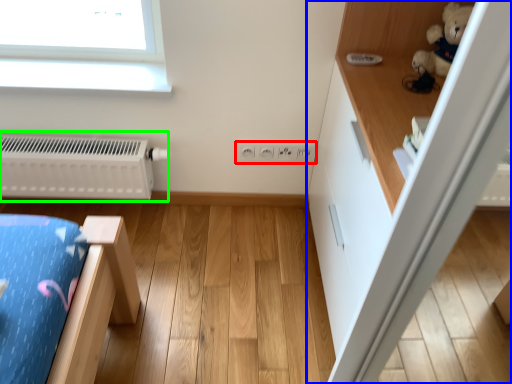
Question: Based on their relative distances, which object is nearer to electric outlet (highlighted by a red box)? Choose from dresser (highlighted by a blue box) and radiator (highlighted by a green box).

Choices:
 (A) dresser
 (B) radiator

Answer: (A)